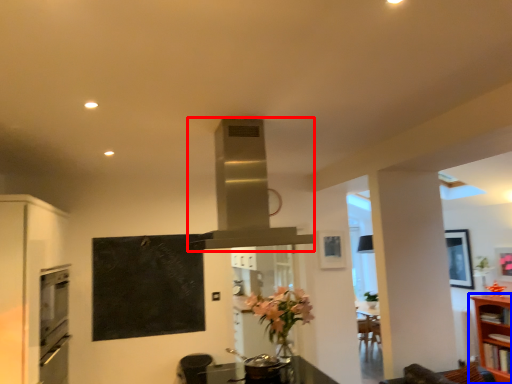
Question: Which object is closer to the camera taking this photo, exhaust hood (highlighted by a red box) or shelf (highlighted by a blue box)?

Choices:
 (A) exhaust hood
 (B) shelf

Answer: (A)